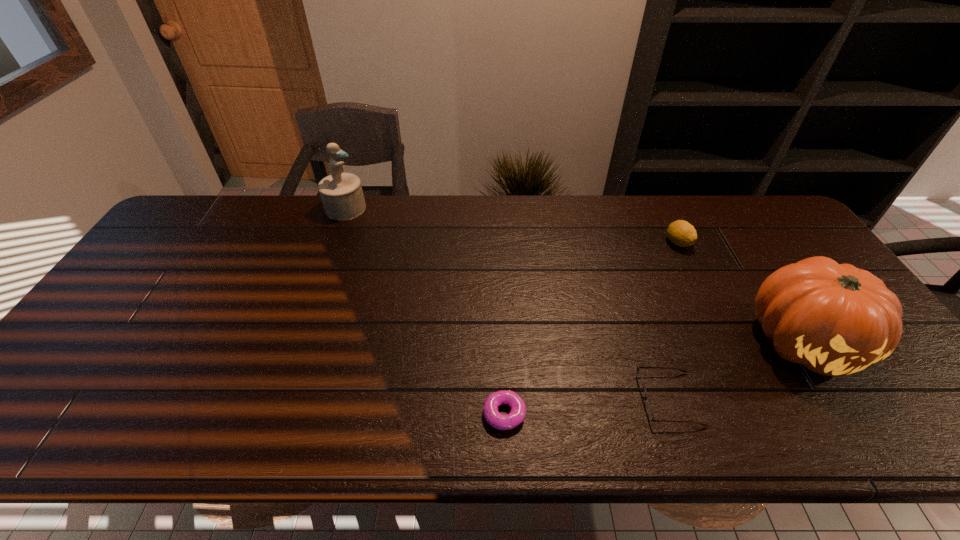
The image size is (960, 540). In the image, there is a desktop. Identify the location of vacant region at the left edge. click(69, 360).

Where is `vacant region at the far right corner of the desktop`? Image resolution: width=960 pixels, height=540 pixels. vacant region at the far right corner of the desktop is located at coordinates (792, 235).

The image size is (960, 540). In order to click on free space between the figurine and the second object from left to right in this screenshot , I will do `click(425, 311)`.

At what (x,y) coordinates should I click in order to perform the action: click on blank region between the doughnut and the spectacles. Please return your answer as a coordinate pair (x, y). The height and width of the screenshot is (540, 960). Looking at the image, I should click on (587, 406).

What are the coordinates of `free spot between the doughnut and the third object from right to left` in the screenshot? It's located at (587, 406).

Where is `free space between the third object from right to left and the farthest object`? The height and width of the screenshot is (540, 960). free space between the third object from right to left and the farthest object is located at coordinates (507, 303).

This screenshot has width=960, height=540. What are the coordinates of `unoccupied area between the pumpkin and the second object from left to right` in the screenshot? It's located at (654, 377).

Where is `vacant space in between the doughnut and the rightmost object`? vacant space in between the doughnut and the rightmost object is located at coordinates (654, 377).

You are a GUI agent. You are given a task and a screenshot of the screen. Output one action in this format:
    pyautogui.click(x=<x>, y=<y>)
    Task: Click on the empty space that is in between the third object from left to right and the fourth nearest object
    The height and width of the screenshot is (540, 960).
    Given the screenshot: What is the action you would take?
    pyautogui.click(x=674, y=320)

Identify the location of free space between the spectacles and the rightmost object. (736, 370).